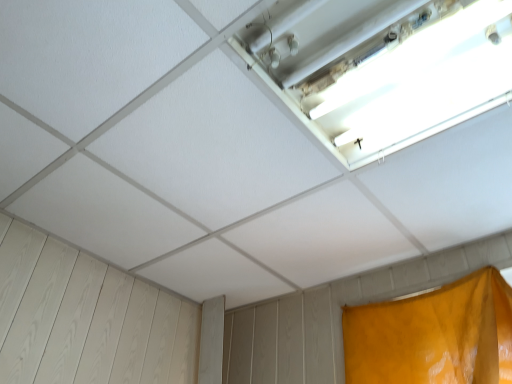
Describe the element at coordinates (382, 67) in the screenshot. The width and height of the screenshot is (512, 384). I see `white fluorescent light at upper right` at that location.

What are the coordinates of `white fluorescent light at upper right` in the screenshot? It's located at (382, 67).

The height and width of the screenshot is (384, 512). Find the location of `white fluorescent light at upper right`. white fluorescent light at upper right is located at coordinates (382, 67).